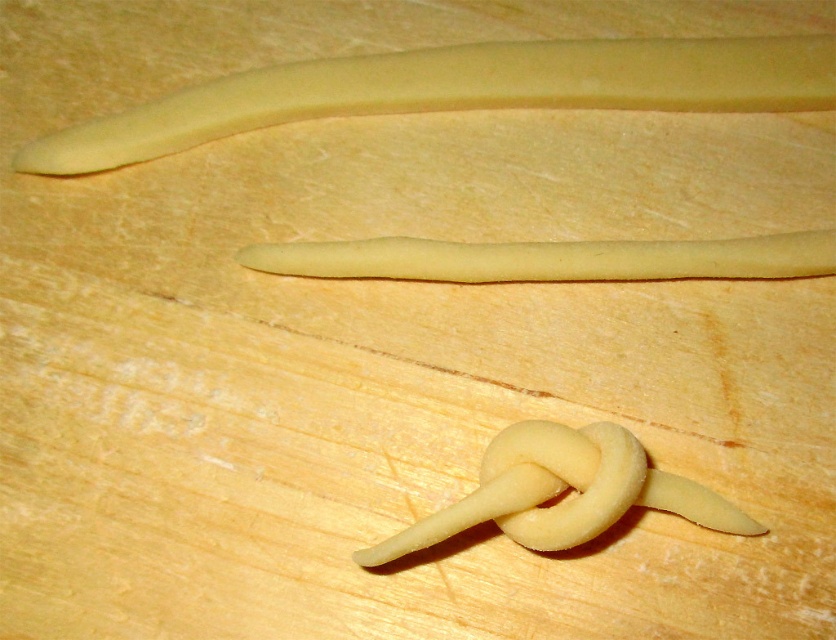
Where is the yellow matte dough at upper center located in the image?

The yellow matte dough at upper center is located at point (461, 90) in the image.

From the picture: You are a baker trying to arrange dough pieces on a tray. You have the yellow matte dough at upper center and the yellow dough stick at center. Which dough piece should you place higher on the tray to avoid overlapping with the other?

The yellow matte dough at upper center is taller than the yellow dough stick at center, so you should place the yellow matte dough at upper center higher on the tray to avoid overlapping with the yellow dough stick at center.

You are a baker trying to shape dough into a knot. You have two pieces of dough in front of you, the matte yellow dough at center and the yellow dough stick at center. Which one is closer to you?

The matte yellow dough at center is closer to the viewer than the yellow dough stick at center.